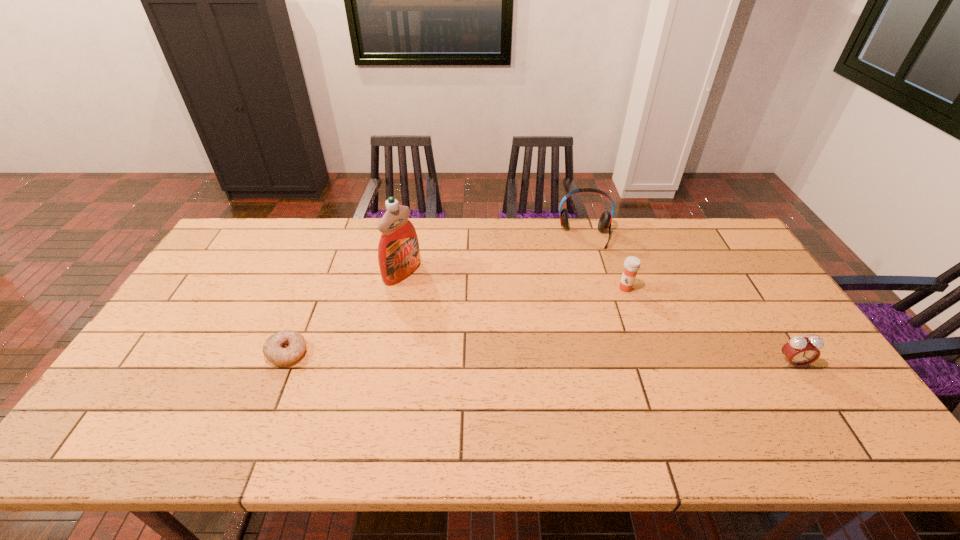
At what (x,y) coordinates should I click in order to perform the action: click on free space that is in between the headset and the shortest object. Please return your answer as a coordinate pair (x, y). Looking at the image, I should click on (436, 294).

Where is `empty space that is in between the shortest object and the medicine`? empty space that is in between the shortest object and the medicine is located at coordinates (456, 321).

Identify the location of vacant area between the shortest object and the farthest object. click(x=436, y=294).

Identify the location of free space between the second tallest object and the medicine. (605, 262).

Locate an element on the screen. free area in between the alarm clock and the medicine is located at coordinates (708, 326).

The height and width of the screenshot is (540, 960). Find the location of `free space between the leftmost object and the alarm clock`. free space between the leftmost object and the alarm clock is located at coordinates (540, 358).

The height and width of the screenshot is (540, 960). In order to click on vacant space that's between the headset and the medicine in this screenshot , I will do `click(605, 262)`.

Select which object is the third closest to the leftmost object. Please provide its 2D coordinates. Your answer should be formatted as a tuple, i.e. [(x, y)], where the tuple contains the x and y coordinates of a point satisfying the conditions above.

[(632, 264)]

Identify which object is the fourth nearest to the farthest object. Please provide its 2D coordinates. Your answer should be formatted as a tuple, i.e. [(x, y)], where the tuple contains the x and y coordinates of a point satisfying the conditions above.

[(282, 348)]

What are the coordinates of `vacant space that satisfies the following two spatial constraints: 1. on the front side of the detergent; 2. on the right side of the medicine` in the screenshot? It's located at (399, 288).